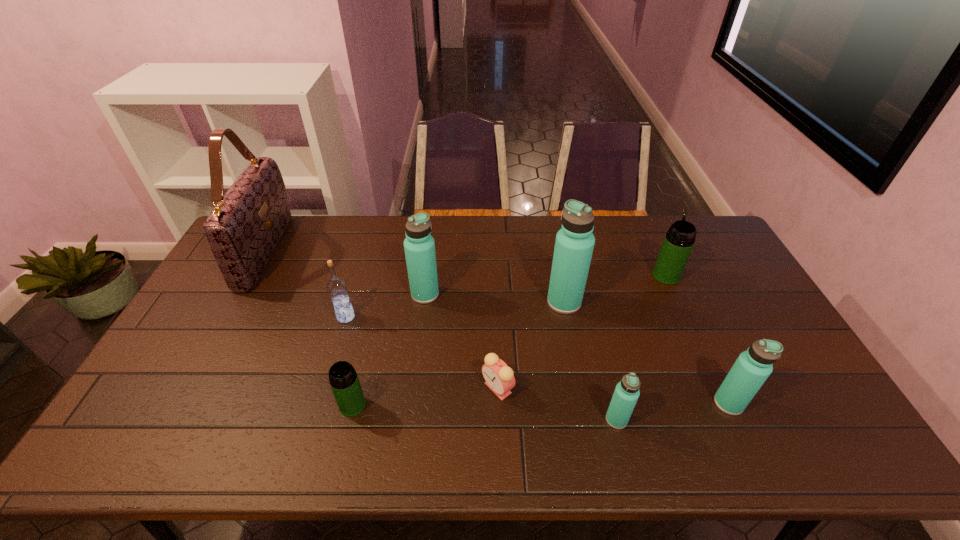
The image size is (960, 540). Identify the location of object positioned at the near edge. (626, 394).

This screenshot has height=540, width=960. Identify the location of object located at the left edge. (243, 229).

Locate an element on the screen. The height and width of the screenshot is (540, 960). object present at the far left corner is located at coordinates (243, 229).

Image resolution: width=960 pixels, height=540 pixels. I want to click on vacant space at the far edge of the desktop, so click(x=457, y=231).

This screenshot has width=960, height=540. In the image, there is a desktop. Find the location of `vacant space at the near edge`. vacant space at the near edge is located at coordinates (740, 437).

Find the location of a particular element. The image size is (960, 540). vacant space at the left edge of the desktop is located at coordinates (211, 299).

The height and width of the screenshot is (540, 960). In the image, there is a desktop. Find the location of `vacant space at the right edge`. vacant space at the right edge is located at coordinates (810, 420).

This screenshot has width=960, height=540. In order to click on free region at the far right corner in this screenshot , I will do `click(665, 216)`.

Locate an element on the screen. This screenshot has width=960, height=540. vacant space at the near right corner of the desktop is located at coordinates (834, 428).

This screenshot has width=960, height=540. Find the location of `vacant point located between the vodka and the third object from left to right`. vacant point located between the vodka and the third object from left to right is located at coordinates (349, 361).